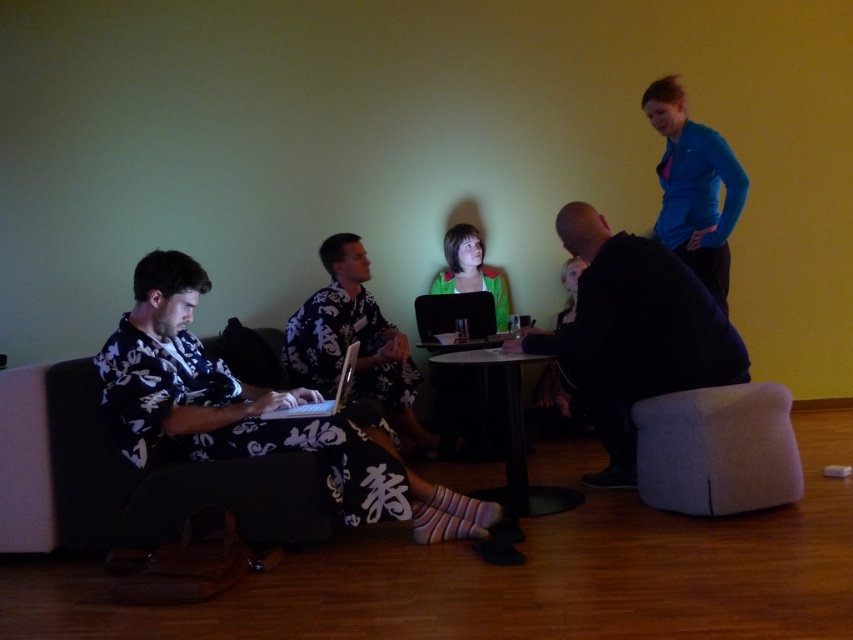
Question: Can you confirm if white floral shirt at left is thinner than black plastic table at center?

Choices:
 (A) no
 (B) yes

Answer: (A)

Question: Is black glossy laptop at center smaller than matte black laptop at center?

Choices:
 (A) no
 (B) yes

Answer: (B)

Question: Among these points, which one is nearest to the camera?

Choices:
 (A) (479, 362)
 (B) (485, 269)
 (C) (662, 305)
 (D) (196, 387)

Answer: (D)

Question: Which point is farther from the camera taking this photo?

Choices:
 (A) (440, 316)
 (B) (154, 285)

Answer: (A)

Question: Which object is the farthest from the white floral shirt at left?

Choices:
 (A) blue fleece jacket at upper right
 (B) gray fabric armchair at lower right
 (C) floral fabric shirt at center
 (D) black fabric armchair at left

Answer: (A)

Question: Does black glossy laptop at center appear over matte black laptop at center?

Choices:
 (A) yes
 (B) no

Answer: (A)